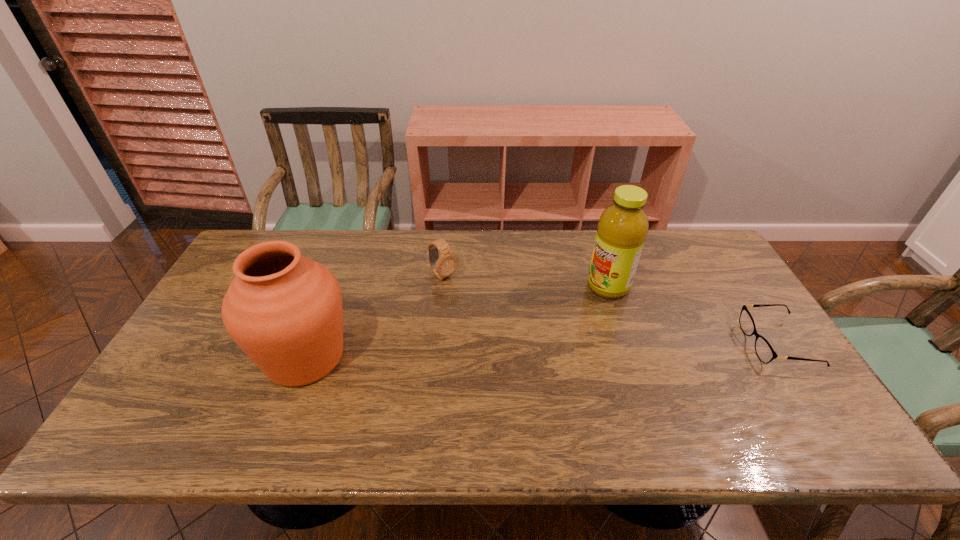
Locate an element on the screen. Image resolution: width=960 pixels, height=540 pixels. vacant space that is in between the leftmost object and the second object from right to left is located at coordinates (457, 322).

At what (x,y) coordinates should I click in order to perform the action: click on empty space that is in between the urn and the second shortest object. Please return your answer as a coordinate pair (x, y). Image resolution: width=960 pixels, height=540 pixels. Looking at the image, I should click on (374, 316).

Identify the location of unoccupied area between the third object from left to right and the leftmost object. Image resolution: width=960 pixels, height=540 pixels. (457, 322).

Identify the location of vacant space that's between the fruit juice and the urn. The width and height of the screenshot is (960, 540). 457,322.

Locate which object is the closest to the fruit juice. Please provide its 2D coordinates. Your answer should be formatted as a tuple, i.e. [(x, y)], where the tuple contains the x and y coordinates of a point satisfying the conditions above.

[(763, 349)]

At what (x,y) coordinates should I click in order to perform the action: click on object that is the second nearest to the second object from left to right. Please return your answer as a coordinate pair (x, y). Image resolution: width=960 pixels, height=540 pixels. Looking at the image, I should click on (622, 229).

Image resolution: width=960 pixels, height=540 pixels. Find the location of `vacant position in the image that satisfies the following two spatial constraints: 1. on the front side of the watch; 2. on the right side of the third object from left to right`. vacant position in the image that satisfies the following two spatial constraints: 1. on the front side of the watch; 2. on the right side of the third object from left to right is located at coordinates (443, 286).

Locate an element on the screen. free point that satisfies the following two spatial constraints: 1. on the back side of the second object from right to left; 2. on the left side of the leftmost object is located at coordinates (332, 286).

Locate an element on the screen. vacant space that satisfies the following two spatial constraints: 1. on the back side of the leftmost object; 2. on the front-facing side of the shortest object is located at coordinates (310, 344).

Where is `vacant region that satisfies the following two spatial constraints: 1. on the front side of the third tallest object; 2. on the front-facing side of the spectacles`? vacant region that satisfies the following two spatial constraints: 1. on the front side of the third tallest object; 2. on the front-facing side of the spectacles is located at coordinates (437, 344).